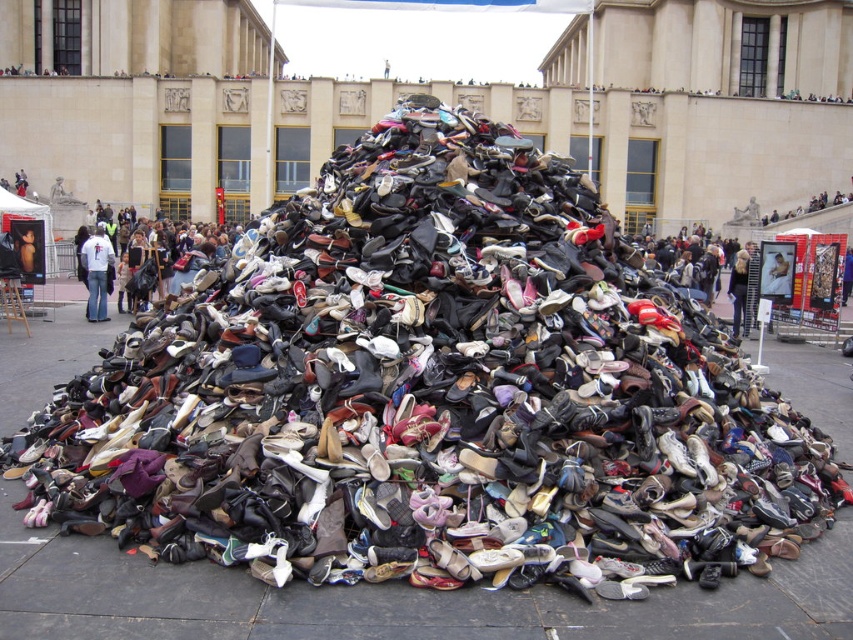
Does point (741, 305) lie behind point (851, 250)?

No.

Can you confirm if light blue jeans at center is thinner than dark blue jeans at center?

In fact, light blue jeans at center might be wider than dark blue jeans at center.

Which is behind, point (734, 333) or point (850, 269)?

Point (850, 269)

This screenshot has width=853, height=640. Identify the location of light blue jeans at center. (740, 292).

Can you confirm if white cotton shirt at center is wider than dark blue jeans at center?

Yes, white cotton shirt at center is wider than dark blue jeans at center.

Can you confirm if white cotton shirt at center is taller than dark blue jeans at center?

Yes, white cotton shirt at center is taller than dark blue jeans at center.

Between point (94, 301) and point (842, 291), which one is positioned behind?

The point (94, 301) is more distant.

The width and height of the screenshot is (853, 640). I want to click on white cotton shirt at center, so click(x=97, y=273).

Consider the image. Is denim jacket at center below smooth skin face at center?

No.

Which of these two, denim jacket at center or smooth skin face at center, stands taller?

denim jacket at center is taller.

Identify the location of denim jacket at center. The height and width of the screenshot is (640, 853). (164, 266).

This screenshot has width=853, height=640. I want to click on denim jacket at center, so click(x=164, y=266).